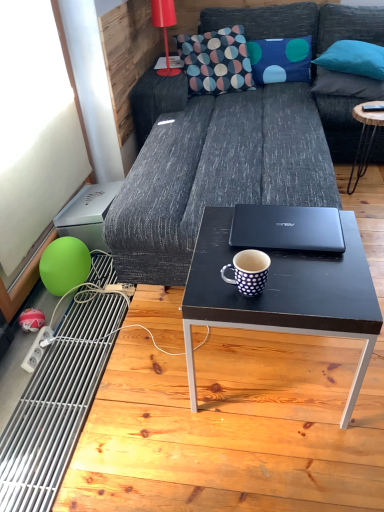
In order to click on vacant region to the left of black matte laptop at center in this screenshot , I will do coord(214,245).